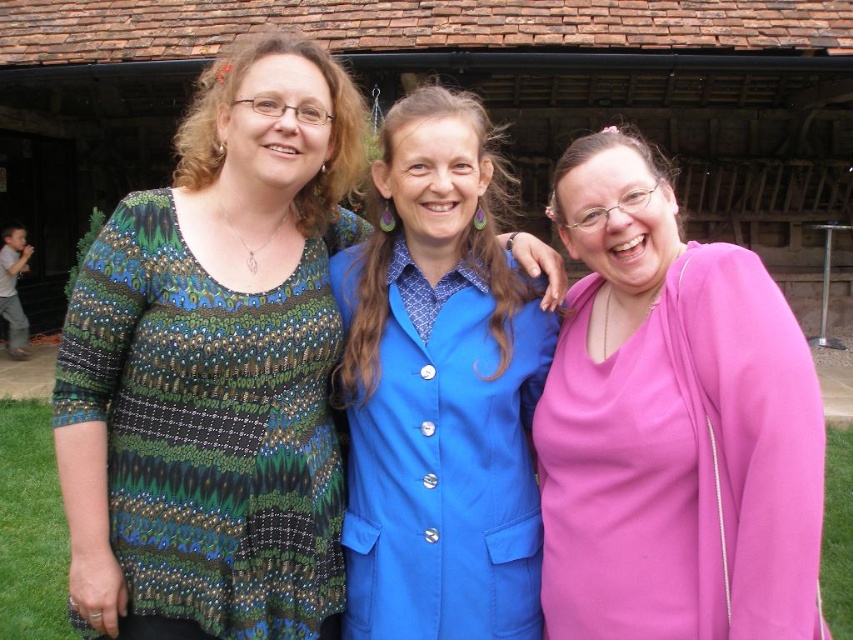
I want to click on pink satin dress at center, so click(x=672, y=426).

What do you see at coordinates (672, 426) in the screenshot?
I see `pink satin dress at center` at bounding box center [672, 426].

Which is behind, point (590, 561) or point (448, 436)?

The point (448, 436) is behind.

This screenshot has width=853, height=640. I want to click on pink satin dress at center, so click(672, 426).

Does multicolored textured blouse at center appear under pink satin dress at center?

Actually, multicolored textured blouse at center is above pink satin dress at center.

Between point (135, 269) and point (657, 192), which one is positioned behind?

Positioned behind is point (657, 192).

You are a GUI agent. You are given a task and a screenshot of the screen. Output one action in this format:
    pyautogui.click(x=<x>, y=<y>)
    Task: Click on the multicolored textured blouse at center
    The image size is (853, 640).
    Given the screenshot: What is the action you would take?
    pyautogui.click(x=215, y=368)

Between multicolored textured blouse at center and blue satin blazer at center, which one has more height?

multicolored textured blouse at center is taller.

Which is more to the right, multicolored textured blouse at center or blue satin blazer at center?

From the viewer's perspective, blue satin blazer at center appears more on the right side.

Locate an element on the screen. This screenshot has height=640, width=853. multicolored textured blouse at center is located at coordinates (215, 368).